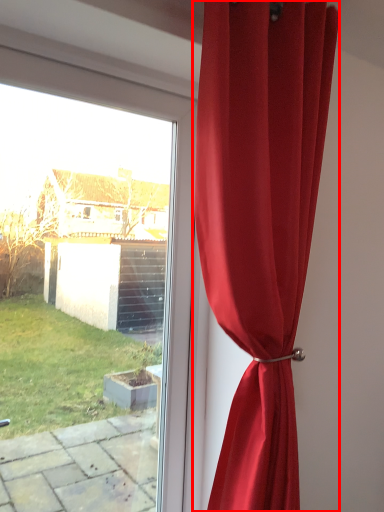
Question: From the image's perspective, what is the correct spatial relationship of curtain (annotated by the red box) in relation to window?

Choices:
 (A) above
 (B) below

Answer: (A)